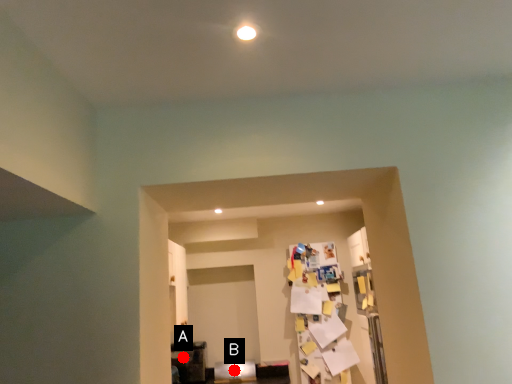
Question: Two points are circled on the image, labeled by A and B beside each circle. Which point appears closest to the camera in this image?

Choices:
 (A) A is closer
 (B) B is closer

Answer: (A)